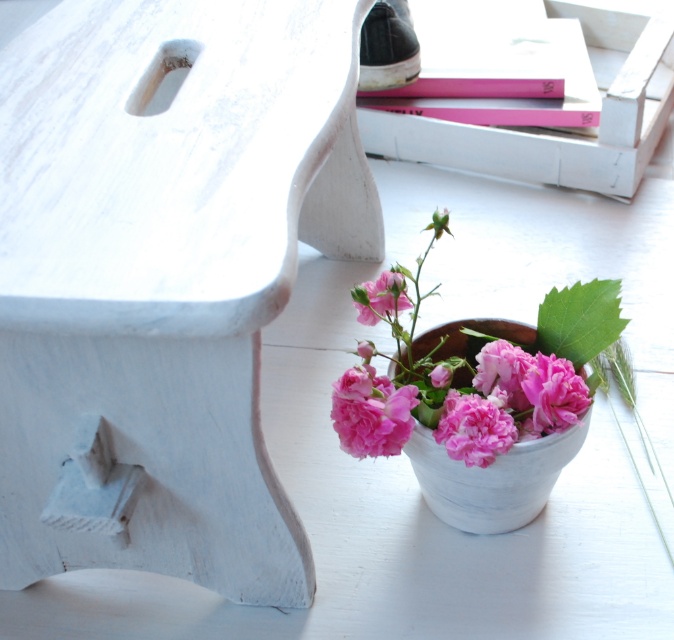
Where is `white glazed vase at lower right`? The height and width of the screenshot is (640, 674). white glazed vase at lower right is located at coordinates (491, 480).

Which is below, suede black shoe at upper center or pink matte flower at center?

pink matte flower at center is below.

Is suede black shoe at upper center further to the viewer compared to pink matte flower at center?

Yes, it is behind pink matte flower at center.

The width and height of the screenshot is (674, 640). What are the coordinates of `suede black shoe at upper center` in the screenshot? It's located at (388, 45).

Who is positioned more to the right, matte pink flower at lower center or pink matte flower at center?

Positioned to the right is matte pink flower at lower center.

From the picture: Which is above, matte pink flower at lower center or pink matte flower at center?

pink matte flower at center is higher up.

The image size is (674, 640). Find the location of `matte pink flower at lower center`. matte pink flower at lower center is located at coordinates (474, 426).